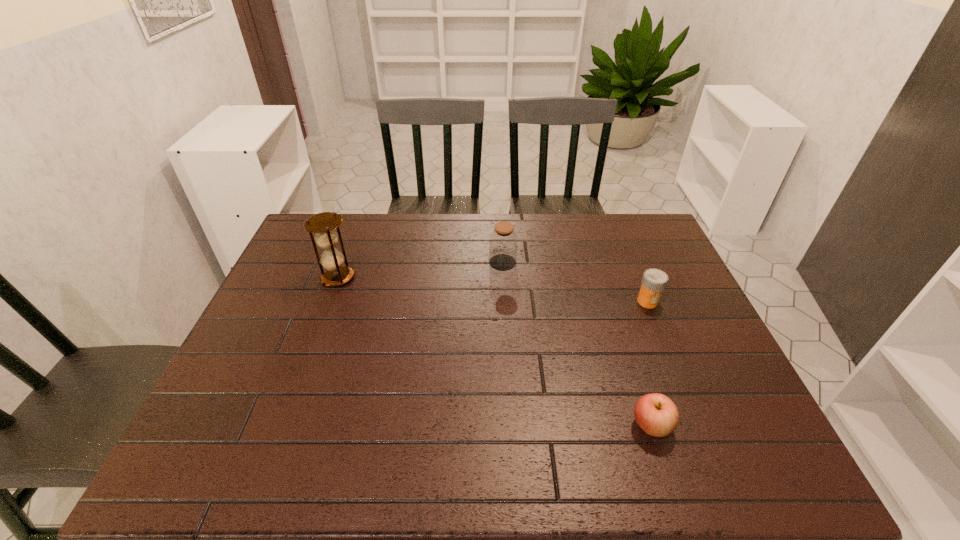
The height and width of the screenshot is (540, 960). In the image, there is a desktop. Find the location of `vacant space at the near left corner`. vacant space at the near left corner is located at coordinates (250, 478).

I want to click on vacant area that lies between the third object from right to left and the rightmost object, so click(x=575, y=282).

This screenshot has width=960, height=540. Identify the location of vacant area that lies between the third farthest object and the third shortest object. 575,282.

I want to click on free space between the tallest object and the nearest object, so click(x=494, y=352).

In order to click on vacant point located between the nearest object and the second tallest object in this screenshot , I will do `click(577, 344)`.

Locate an element on the screen. The width and height of the screenshot is (960, 540). vacant area that lies between the third shortest object and the apple is located at coordinates (577, 344).

Locate an element on the screen. The width and height of the screenshot is (960, 540). free space between the rightmost object and the apple is located at coordinates coord(650,363).

Where is `blank region between the rightmost object and the nearest object`? blank region between the rightmost object and the nearest object is located at coordinates (650, 363).

This screenshot has height=540, width=960. I want to click on free space between the second object from right to left and the third object from right to left, so click(577, 344).

Locate an element on the screen. vacant area that lies between the tallest object and the second object from right to left is located at coordinates (494, 352).